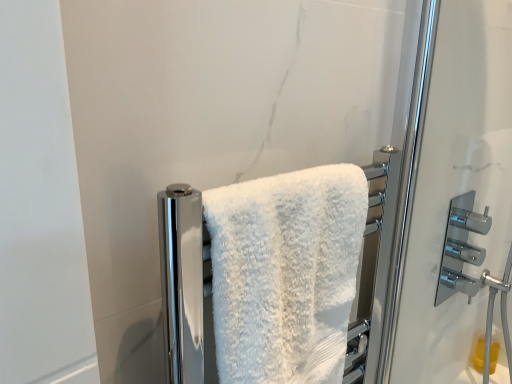
Image resolution: width=512 pixels, height=384 pixels. Describe the element at coordinates (461, 248) in the screenshot. I see `polished chrome faucet at right` at that location.

At what (x,y) coordinates should I click in order to perform the action: click on polished chrome faucet at right. Please return your answer as a coordinate pair (x, y). This screenshot has height=384, width=512. Looking at the image, I should click on (461, 248).

The image size is (512, 384). What do you see at coordinates (285, 273) in the screenshot?
I see `white fluffy towel at center` at bounding box center [285, 273].

Identify the location of white fluffy towel at center. The width and height of the screenshot is (512, 384). (285, 273).

Locate an element on the screen. polished chrome faucet at right is located at coordinates (461, 248).

Does polished chrome faucet at right appear on the left side of white fluffy towel at center?

No.

Is polished chrome faucet at right behind white fluffy towel at center?

Yes, it is.

Does point (480, 229) come closer to viewer compared to point (341, 169)?

No, it is not.

From the image's perspective, who appears lower, polished chrome faucet at right or white fluffy towel at center?

white fluffy towel at center appears lower in the image.

From a real-world perspective, is polished chrome faucet at right physically below white fluffy towel at center?

Yes, from a real-world perspective, polished chrome faucet at right is under white fluffy towel at center.

Considering the relative sizes of polished chrome faucet at right and white fluffy towel at center in the image provided, is polished chrome faucet at right thinner than white fluffy towel at center?

Indeed, polished chrome faucet at right has a lesser width compared to white fluffy towel at center.

Between polished chrome faucet at right and white fluffy towel at center, which one has less height?

Standing shorter between the two is polished chrome faucet at right.

Considering the sizes of objects polished chrome faucet at right and white fluffy towel at center in the image provided, who is smaller, polished chrome faucet at right or white fluffy towel at center?

With smaller size is polished chrome faucet at right.

From the picture: Is polished chrome faucet at right not inside white fluffy towel at center?

Yes, polished chrome faucet at right is outside of white fluffy towel at center.

From the picture: Is the surface of polished chrome faucet at right in direct contact with white fluffy towel at center?

No, polished chrome faucet at right is not next to white fluffy towel at center.

Is polished chrome faucet at right oriented away from white fluffy towel at center?

No, polished chrome faucet at right's orientation is not away from white fluffy towel at center.

How many degrees apart are the facing directions of polished chrome faucet at right and white fluffy towel at center?

The facing directions of polished chrome faucet at right and white fluffy towel at center are 0.426 degrees apart.

Find the location of a particular element. Image resolution: width=512 pixels, height=384 pixels. towel on the left of polished chrome faucet at right is located at coordinates (285, 273).

Can you confirm if white fluffy towel at center is positioned to the left of polished chrome faucet at right?

Yes, white fluffy towel at center is to the left of polished chrome faucet at right.

Which is in front, white fluffy towel at center or polished chrome faucet at right?

white fluffy towel at center is more forward.

Does point (266, 285) appear closer or farther from the camera than point (464, 248)?

Point (266, 285) is closer to the camera than point (464, 248).

From the image's perspective, between white fluffy towel at center and polished chrome faucet at right, which one is located above?

polished chrome faucet at right, from the image's perspective.

From a real-world perspective, is white fluffy towel at center on top of polished chrome faucet at right?

Yes, from a real-world perspective, white fluffy towel at center is above polished chrome faucet at right.

Looking at their sizes, would you say white fluffy towel at center is wider or thinner than polished chrome faucet at right?

Considering their sizes, white fluffy towel at center looks broader than polished chrome faucet at right.

From their relative heights in the image, would you say white fluffy towel at center is taller or shorter than polished chrome faucet at right?

In the image, white fluffy towel at center appears to be taller than polished chrome faucet at right.

Which of these two, white fluffy towel at center or polished chrome faucet at right, is smaller?

polished chrome faucet at right is smaller.

Choose the correct answer: Is white fluffy towel at center inside polished chrome faucet at right or outside it?

white fluffy towel at center is located beyond the bounds of polished chrome faucet at right.

Is white fluffy towel at center placed right next to polished chrome faucet at right?

white fluffy towel at center and polished chrome faucet at right are clearly separated.

Is white fluffy towel at center looking in the opposite direction of polished chrome faucet at right?

No, white fluffy towel at center is not facing away from polished chrome faucet at right.

Can you tell me how much white fluffy towel at center and polished chrome faucet at right differ in facing direction?

white fluffy towel at center and polished chrome faucet at right are facing 0.426 degrees away from each other.

In the scene shown: How far apart are white fluffy towel at center and polished chrome faucet at right?

A distance of 25.57 inches exists between white fluffy towel at center and polished chrome faucet at right.

In the image, there is a white fluffy towel at center. At what (x,y) coordinates should I click in order to perform the action: click on door handle below it (from a real-world perspective). Please return your answer as a coordinate pair (x, y). This screenshot has height=384, width=512. Looking at the image, I should click on (461, 248).

Identify the location of towel on the left of polished chrome faucet at right. (285, 273).

Identify the location of door handle above the white fluffy towel at center (from the image's perspective). (461, 248).